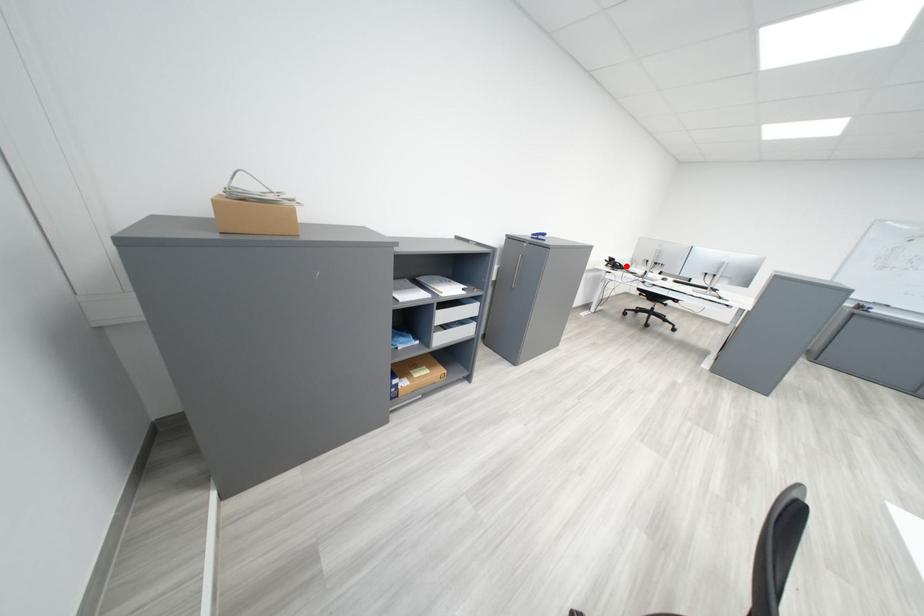
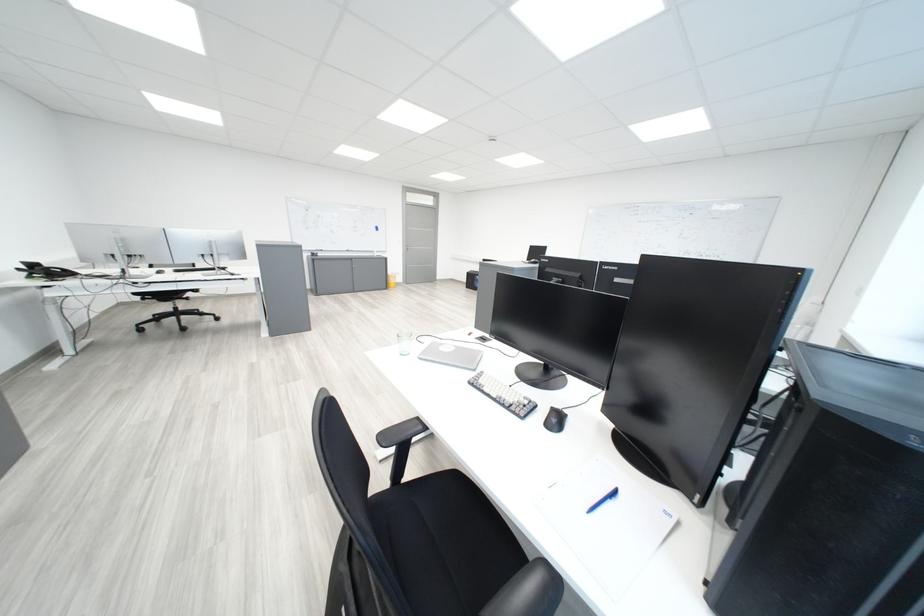
Where in the second image is the point corresponding to the highlighted location from the first image?

(59, 275)